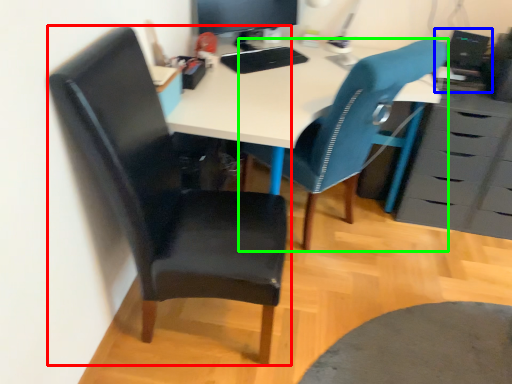
Question: Considering the real-world distances, which object is farthest from chair (highlighted by a red box)? computer (highlighted by a blue box) or chair (highlighted by a green box)?

Choices:
 (A) computer
 (B) chair

Answer: (A)